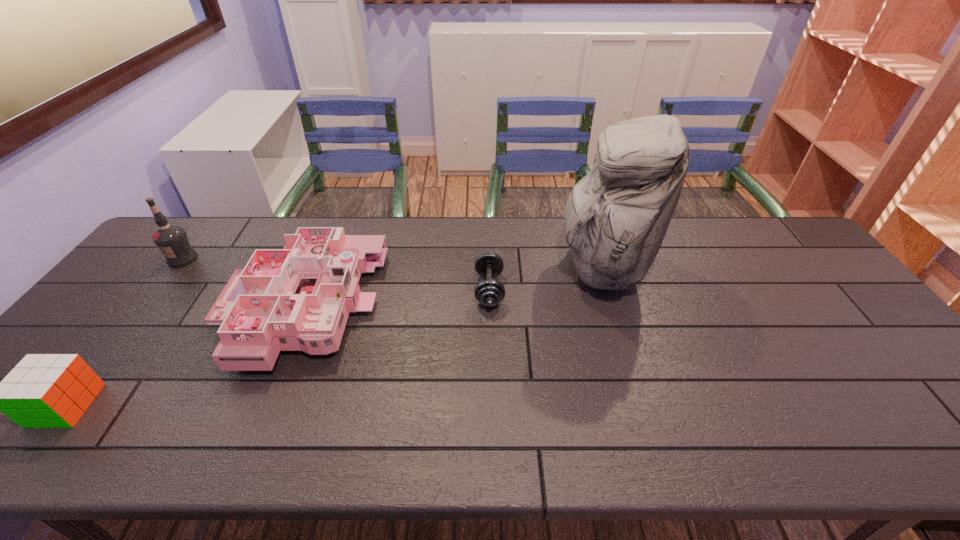
This screenshot has width=960, height=540. What are the coordinates of `vacant space located 0.200m on the front label of the vodka` in the screenshot? It's located at (138, 315).

I want to click on vacant space located 0.190m at the front entrance of the third object from left to right, so click(444, 307).

Locate an element on the screen. free space located on the back of the cube is located at coordinates (146, 303).

Find the location of a particular element. Image resolution: width=960 pixels, height=540 pixels. free location located 0.220m on the right of the shortest object is located at coordinates (x=580, y=289).

Where is `backpack at the far edge`? The width and height of the screenshot is (960, 540). backpack at the far edge is located at coordinates (615, 219).

Find the location of a particular element. The width and height of the screenshot is (960, 540). vodka situated at the far edge is located at coordinates (171, 239).

Identify the location of dollhouse that is at the far edge. The width and height of the screenshot is (960, 540). (298, 298).

The width and height of the screenshot is (960, 540). Identify the location of object at the near edge. (43, 390).

Locate an element on the screen. vodka present at the left edge is located at coordinates (171, 239).

The width and height of the screenshot is (960, 540). I want to click on cube located at the left edge, so click(x=43, y=390).